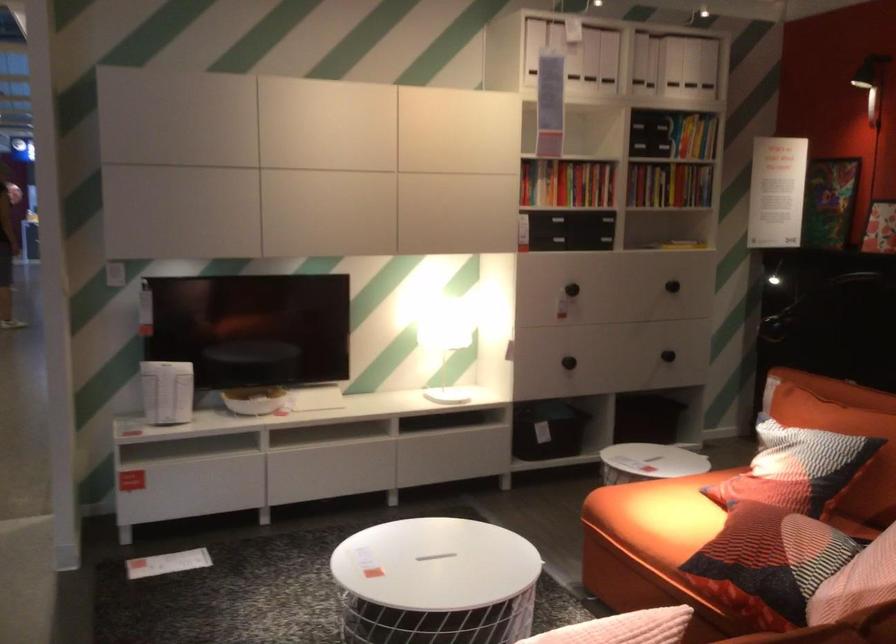
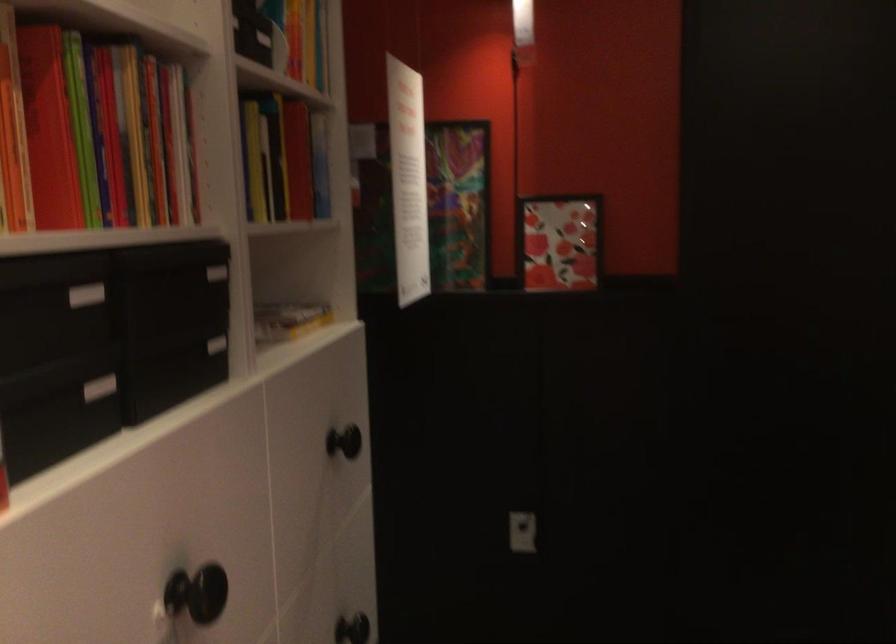
Find the pixel in the second image that matches (588,156) in the first image.

(99, 136)